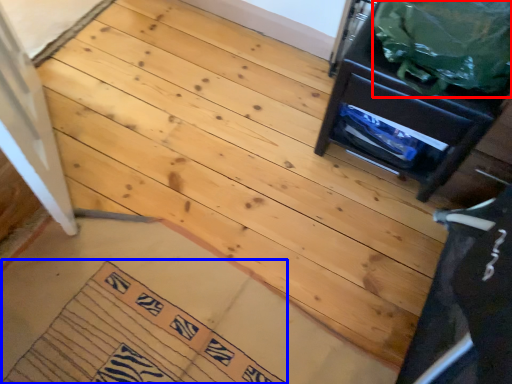
Question: Which of the following is the closest to the observer, garbage (highlighted by a red box) or doormat (highlighted by a blue box)?

Choices:
 (A) garbage
 (B) doormat

Answer: (A)